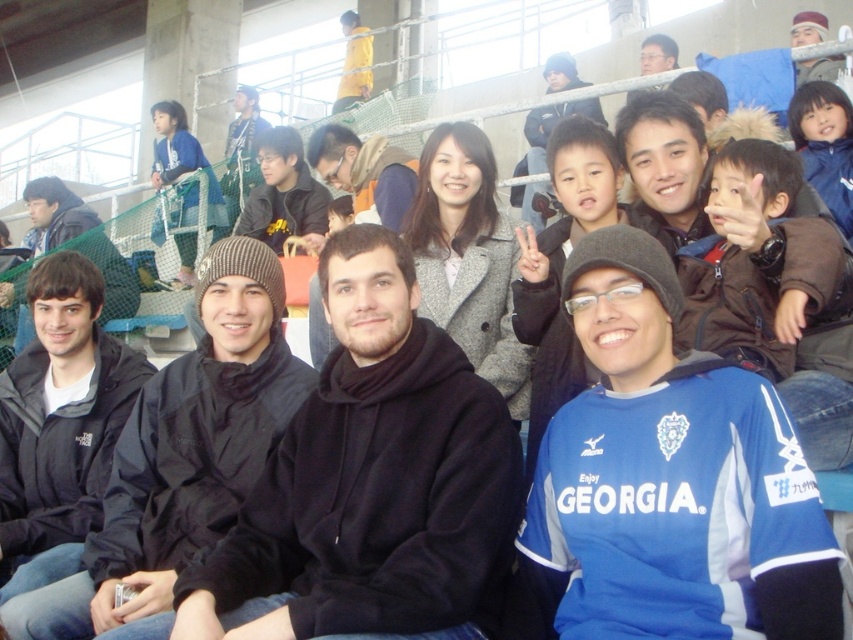
I want to click on blue jersey at center, so click(x=666, y=483).

Does blue jersey at center have a smaller size compared to black matte jacket at center?

Yes, blue jersey at center is smaller than black matte jacket at center.

Is point (585, 301) positioned in front of point (206, 333)?

That is True.

Find the location of a particular element. The width and height of the screenshot is (853, 640). blue jersey at center is located at coordinates (666, 483).

Is black matte jacket at center above matte black jacket at center?

No.

From the picture: Can you confirm if black matte jacket at center is wider than matte black jacket at center?

Yes, black matte jacket at center is wider than matte black jacket at center.

Identify the location of black matte jacket at center. (183, 456).

Is brown knit cap at center below matte black beanie at upper center?

Yes.

Does brown knit cap at center appear over matte black beanie at upper center?

No, brown knit cap at center is not above matte black beanie at upper center.

Where is `brown knit cap at center`? The width and height of the screenshot is (853, 640). brown knit cap at center is located at coordinates (85, 243).